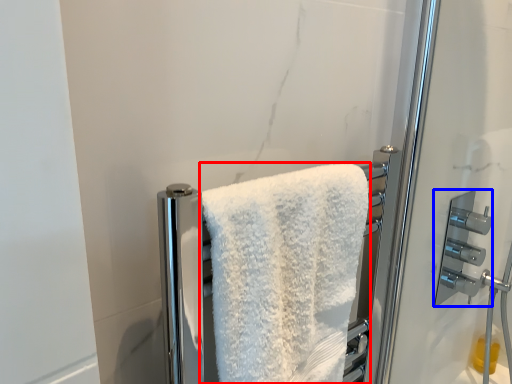
Question: Which object is further to the camera taking this photo, towel (highlighted by a red box) or door handle (highlighted by a blue box)?

Choices:
 (A) towel
 (B) door handle

Answer: (B)